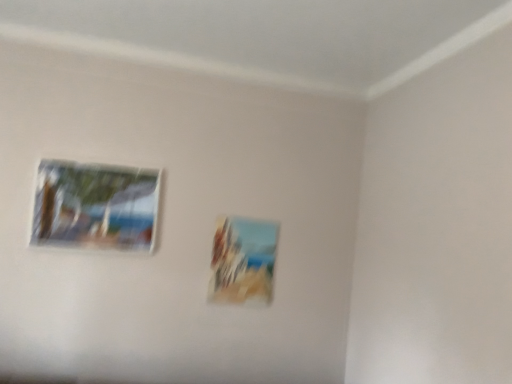
Question: Is matte wooden picture frame at center, which appears as the 1th picture frame when viewed from the back, spatially inside matte glass picture frame at upper left, marked as the 1th picture frame in a left-to-right arrangement, or outside of it?

Choices:
 (A) inside
 (B) outside

Answer: (B)

Question: In terms of height, does matte wooden picture frame at center, acting as the 2th picture frame starting from the front, look taller or shorter compared to matte glass picture frame at upper left, marked as the 1th picture frame in a front-to-back arrangement?

Choices:
 (A) short
 (B) tall

Answer: (B)

Question: Is matte wooden picture frame at center, acting as the 2th picture frame starting from the front, in front of or behind matte glass picture frame at upper left, marked as the 1th picture frame in a front-to-back arrangement, in the image?

Choices:
 (A) behind
 (B) front

Answer: (A)

Question: Which is correct: matte glass picture frame at upper left, marked as the second picture frame in a back-to-front arrangement, is inside matte wooden picture frame at center, arranged as the 2th picture frame when viewed from the left, or outside of it?

Choices:
 (A) outside
 (B) inside

Answer: (A)

Question: Does point (81, 241) appear closer or farther from the camera than point (236, 281)?

Choices:
 (A) farther
 (B) closer

Answer: (B)

Question: From their relative heights in the image, would you say matte glass picture frame at upper left, marked as the 1th picture frame in a front-to-back arrangement, is taller or shorter than matte wooden picture frame at center, arranged as the 2th picture frame when viewed from the left?

Choices:
 (A) short
 (B) tall

Answer: (A)

Question: Looking at the image, does matte glass picture frame at upper left, positioned as the 2th picture frame in right-to-left order, seem bigger or smaller compared to matte wooden picture frame at center, which appears as the 1th picture frame when viewed from the back?

Choices:
 (A) small
 (B) big

Answer: (B)